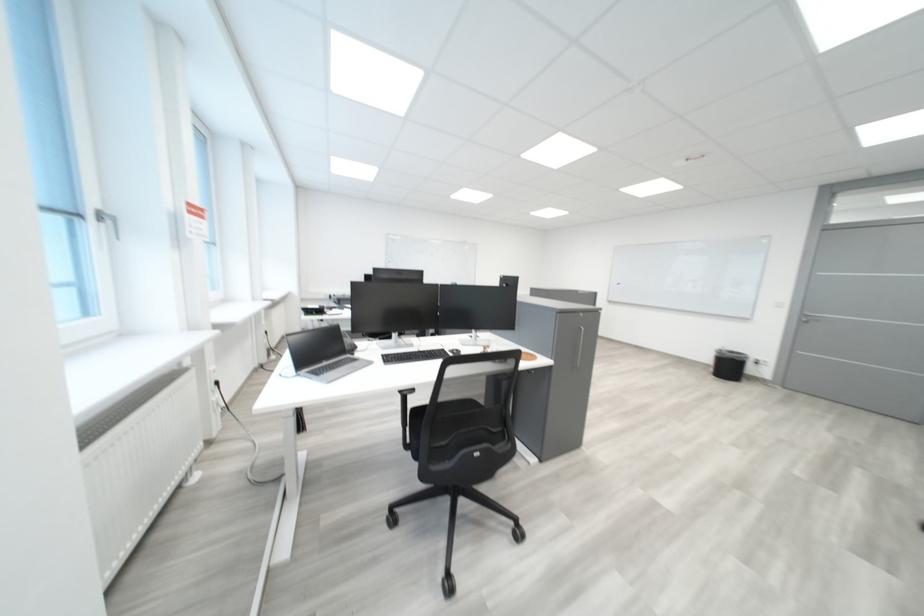
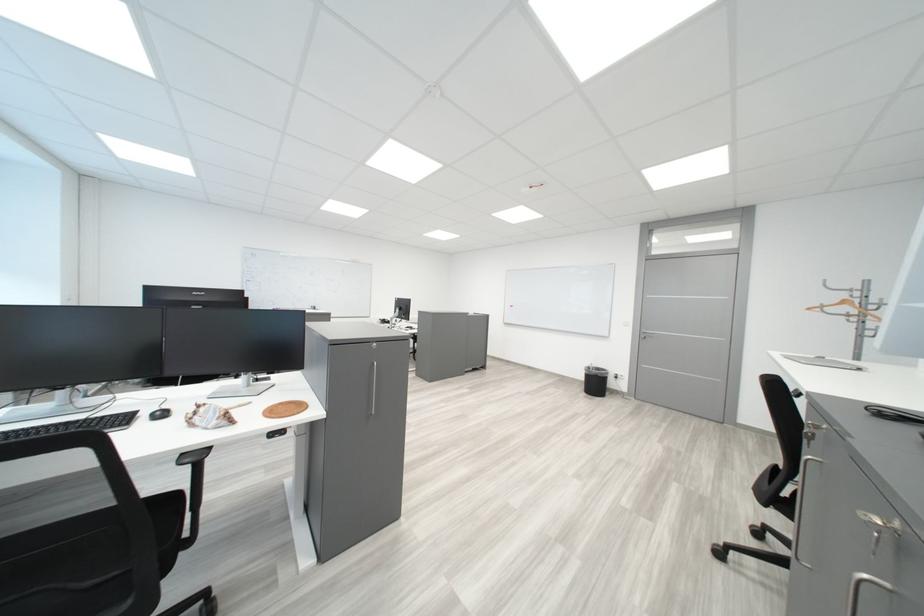
Question: The images are taken continuously from a first-person perspective. In which direction are you moving?

Choices:
 (A) Left
 (B) Right
 (C) Forward
 (D) Backward

Answer: (B)